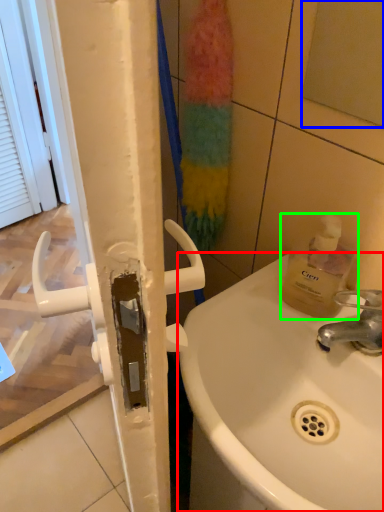
Question: Estimate the real-world distances between objects in this image. Which object is closer to sink (highlighted by a red box), mirror (highlighted by a blue box) or bottle (highlighted by a green box)?

Choices:
 (A) mirror
 (B) bottle

Answer: (B)